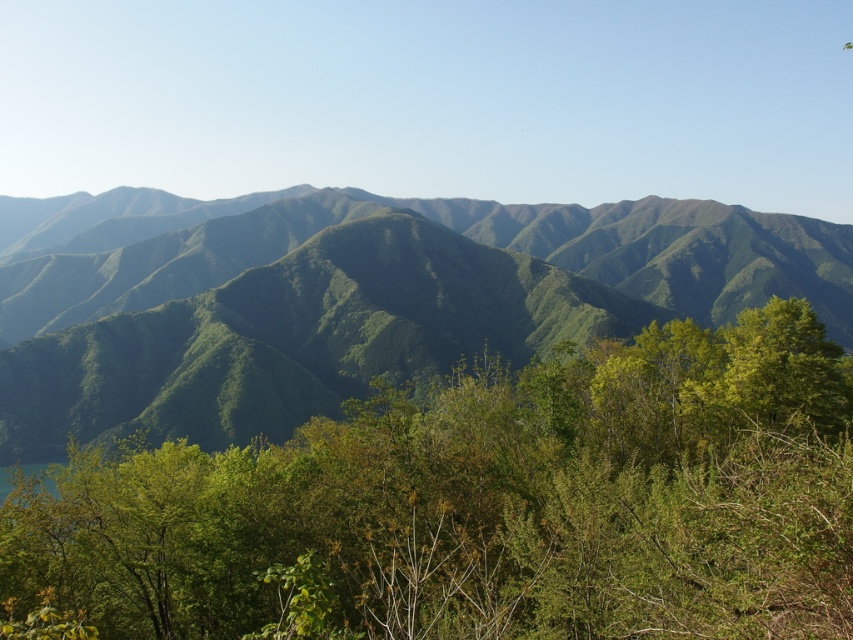
Question: Which object is closer to the camera taking this photo?

Choices:
 (A) green textured mountains at center
 (B) green leafy tree at center

Answer: (B)

Question: Is the position of green leafy tree at center more distant than that of green textured mountains at center?

Choices:
 (A) no
 (B) yes

Answer: (A)

Question: Where is green leafy tree at center located in relation to green textured mountains at center in the image?

Choices:
 (A) right
 (B) left

Answer: (A)

Question: Which of the following is the farthest from the observer?

Choices:
 (A) green textured mountains at center
 (B) green leafy tree at center

Answer: (A)

Question: Does green leafy tree at center appear on the right side of green textured mountains at center?

Choices:
 (A) yes
 (B) no

Answer: (A)